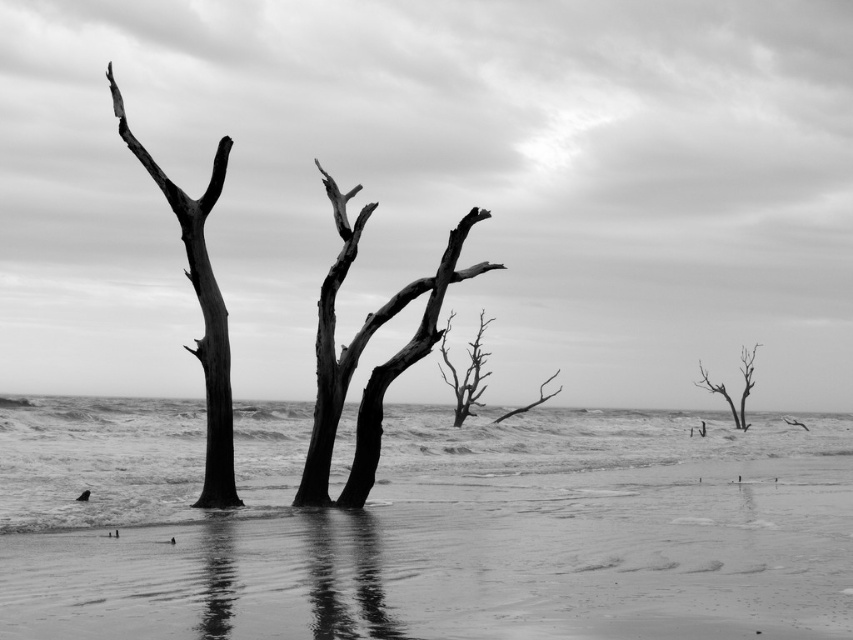
Is the position of dark gray bark tree at left more distant than that of smooth bark tree at right?

No, dark gray bark tree at left is closer to the viewer.

Which of these two, dark gray bark tree at left or smooth bark tree at right, stands taller?

dark gray bark tree at left

Is point (206, 465) closer to camera compared to point (737, 422)?

That is True.

This screenshot has width=853, height=640. Identify the location of dark gray bark tree at left. (201, 310).

Consider the image. Can you confirm if smooth water at center is taller than smooth bark tree at center?

Yes, smooth water at center is taller than smooth bark tree at center.

Does smooth water at center appear under smooth bark tree at center?

Indeed, smooth water at center is positioned under smooth bark tree at center.

Which is behind, point (100, 522) or point (364, 220)?

Positioned behind is point (364, 220).

Identify the location of smooth water at center. (590, 451).

How distant is smooth water at center from dead wood tree at center?

They are 10.79 meters apart.

Who is shorter, smooth water at center or dead wood tree at center?

Standing shorter between the two is dead wood tree at center.

What do you see at coordinates (590, 451) in the screenshot? I see `smooth water at center` at bounding box center [590, 451].

The image size is (853, 640). What are the coordinates of `smooth water at center` in the screenshot? It's located at (590, 451).